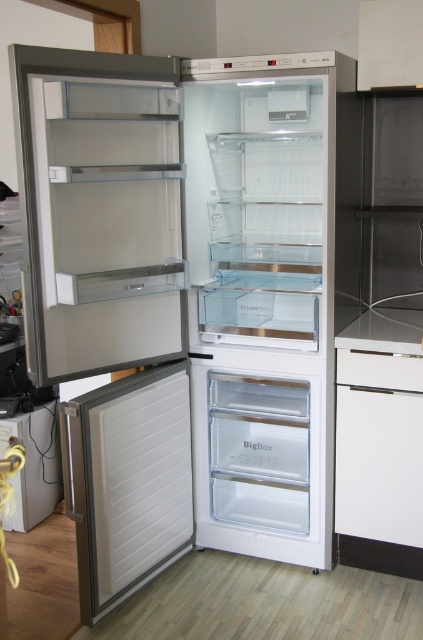
You are standing in front of the refrigerator and need to locate the white matte door at lower left. According to the spatial layout, where exactly is it positioned?

The white matte door at lower left is located at point (128, 481).

You have a large container that is 1 meter in length. You want to place it on the white glossy counter top at lower right or store it in the transparent plastic drawer at center. Based on their sizes, which location can accommodate the container?

The transparent plastic drawer at center has a larger size compared to the white glossy counter top at lower right, so the container can be placed in the transparent plastic drawer at center.

You are trying to place a new shelf in the refrigerator. You have two points marked inside the fridge. The first point is at coordinate point (258, 556) and the second is at point (406, 326). If you want to place the shelf so that it is behind both points, where should you position it?

The shelf should be placed behind both points, but according to the description, point (258, 556) is already behind point (406, 326). Therefore, placing the shelf behind point (258, 556) would ensure it is behind both points.